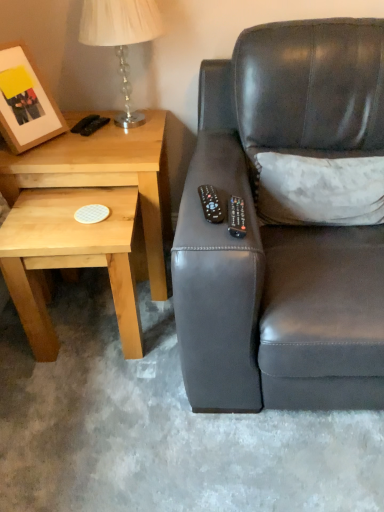
Where is `empty space that is ontop of light wood/texture coaster at lower left (from a real-world perspective)`? The height and width of the screenshot is (512, 384). empty space that is ontop of light wood/texture coaster at lower left (from a real-world perspective) is located at coordinates (70, 214).